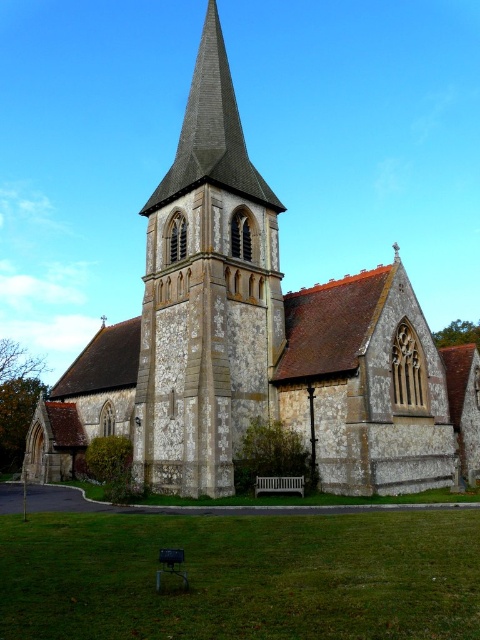
You are a drone operator planning to fly a drone over the stone church at center and the stone spire at center. Considering the height differences between them, which one requires a higher altitude setting to ensure safe passage?

The stone church at center has a greater height compared to the stone spire at center, so you should set the drone to a higher altitude to safely pass over the stone church at center.